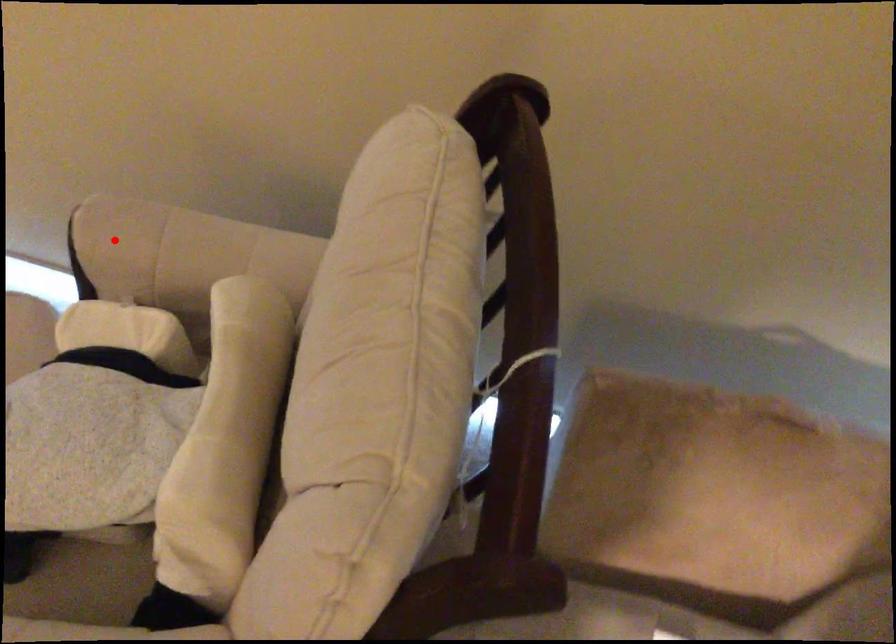
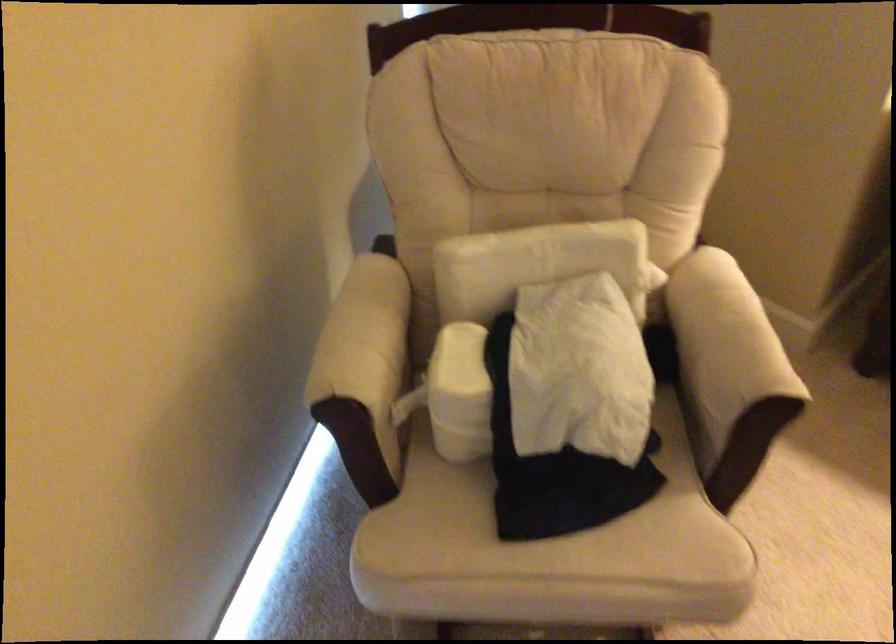
Find the pixel in the second image that matches the highlighted location in the first image.

(364, 373)